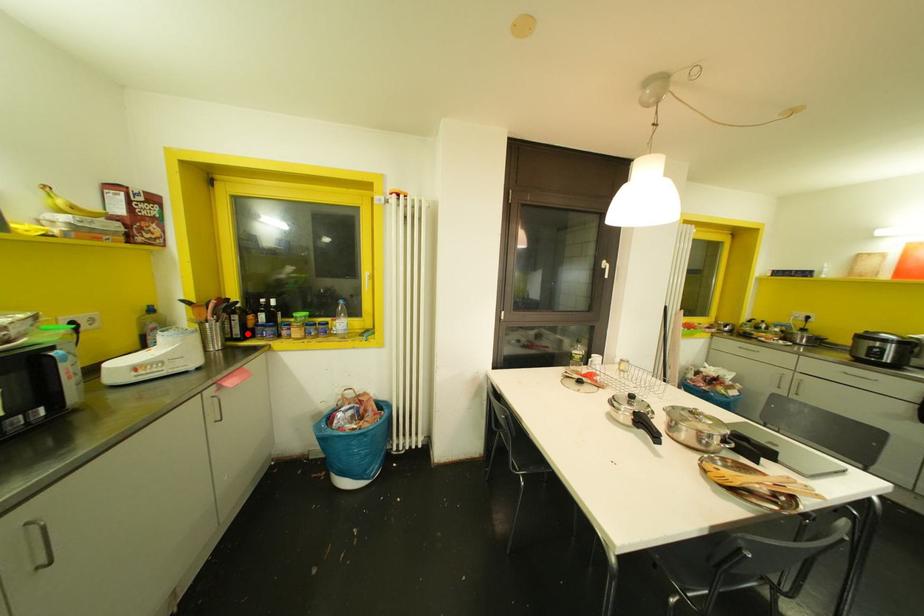
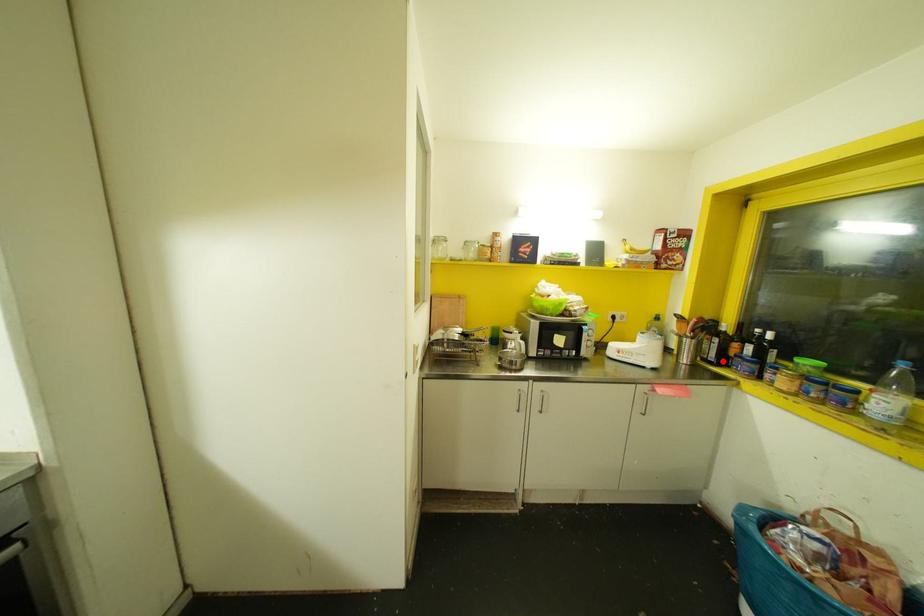
I am providing you with two images of the same scene from different viewpoints. A red point is marked on the first image and another point is marked on the second image. Is the red point in image1 aligned with the point shown in image2?

Yes